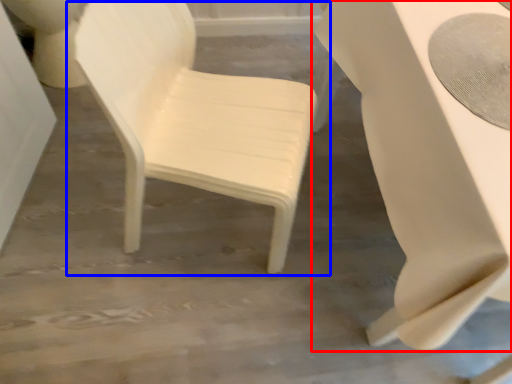
Question: Which of the following is the closest to the observer, table (highlighted by a red box) or chair (highlighted by a blue box)?

Choices:
 (A) table
 (B) chair

Answer: (A)